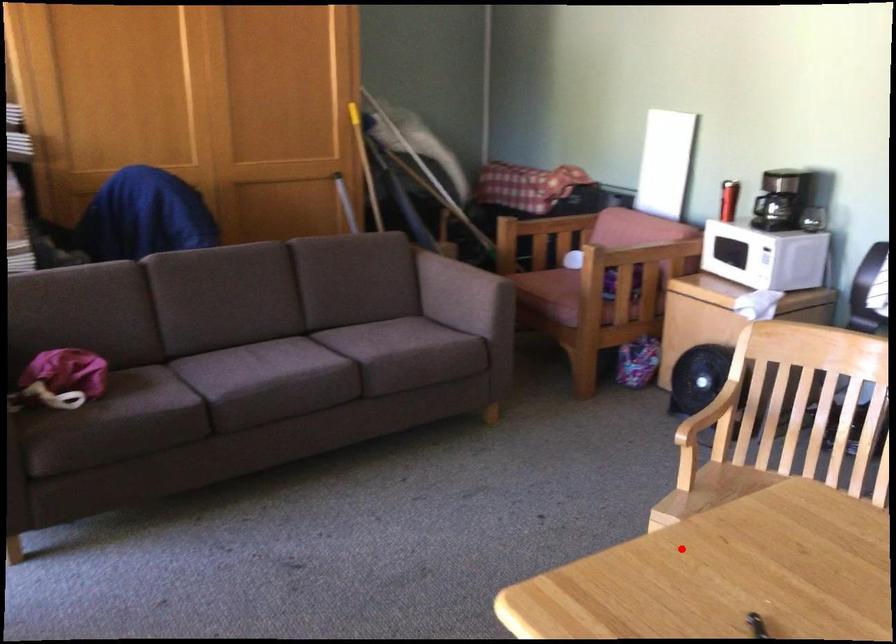
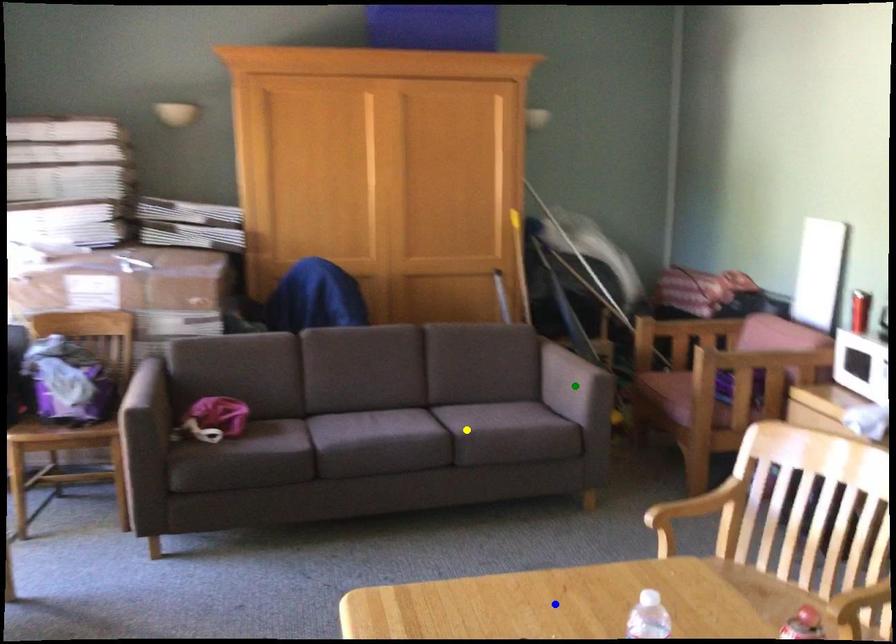
Question: I am providing you with two images of the same scene from different viewpoints. A red point is marked on the first image. You are given multiple points on the second image. Can you choose the point in image 2 that corresponds to the point in image 1?

Choices:
 (A) yellow point
 (B) blue point
 (C) green point

Answer: (B)